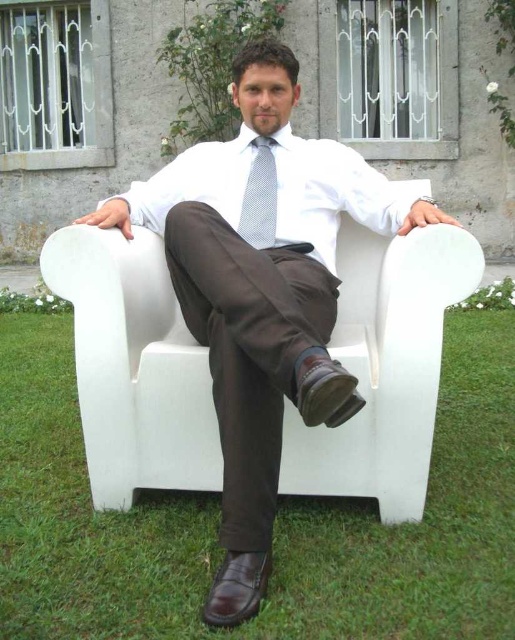
Question: In this image, where is matte white suit at center located relative to white dotted fabric tie at center?

Choices:
 (A) above
 (B) below

Answer: (B)

Question: Among these objects, which one is nearest to the camera?

Choices:
 (A) matte white suit at center
 (B) white dotted fabric tie at center

Answer: (A)

Question: Which point is farther to the camera?

Choices:
 (A) (310, 221)
 (B) (251, 161)

Answer: (B)

Question: Which point is closer to the camera taking this photo?

Choices:
 (A) (309, 243)
 (B) (247, 56)
 (C) (272, 141)

Answer: (A)

Question: Is matte white suit at center bigger than white smooth dress shirt at center?

Choices:
 (A) no
 (B) yes

Answer: (B)

Question: Does white smooth dress shirt at center appear over white dotted fabric tie at center?

Choices:
 (A) no
 (B) yes

Answer: (A)